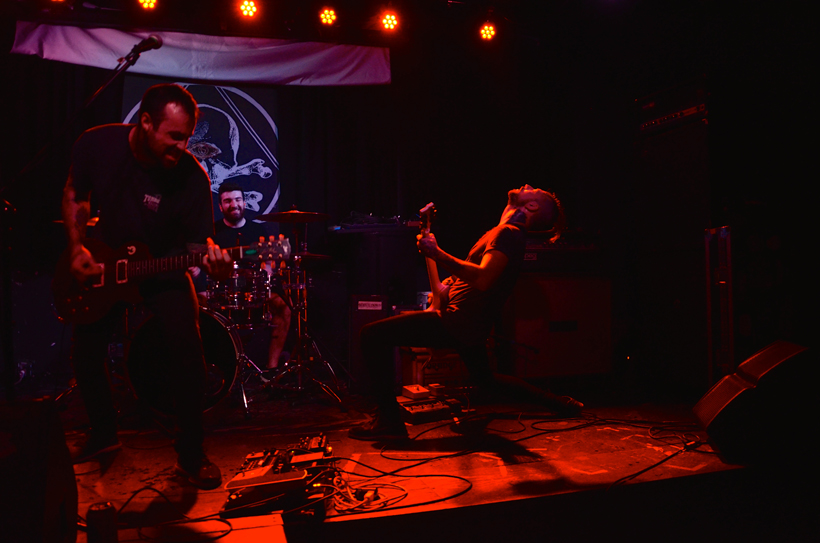
This screenshot has width=820, height=543. In order to click on speakers in this screenshot , I will do `click(750, 392)`.